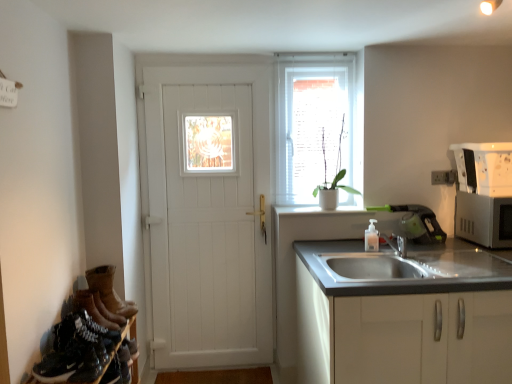
This screenshot has height=384, width=512. Describe the element at coordinates (321, 211) in the screenshot. I see `white glossy window sill at center` at that location.

Find the location of a particular element. white wooden door at center is located at coordinates (209, 221).

Find the location of a particular element. The image size is (512, 384). black leather shoe at lower left, positioned as the first shoe in back-to-front order is located at coordinates (92, 309).

How different are the orientations of brown suede boots at lower left and translucent plastic soap dispenser at sink right in degrees?

They differ by 90.2 degrees in their facing directions.

Considering the relative sizes of brown suede boots at lower left and translucent plastic soap dispenser at sink right in the image provided, is brown suede boots at lower left smaller than translucent plastic soap dispenser at sink right?

Actually, brown suede boots at lower left might be larger than translucent plastic soap dispenser at sink right.

Choose the correct answer: Is brown suede boots at lower left inside translucent plastic soap dispenser at sink right or outside it?

The correct answer is: outside.

Which is behind, point (111, 276) or point (376, 221)?

The point (376, 221) is farther.

Between white plastic electric outlet at upper right and white ceramic pot at window, which one has smaller width?

With smaller width is white plastic electric outlet at upper right.

From the picture: In terms of size, does white plastic electric outlet at upper right appear bigger or smaller than white ceramic pot at window?

Clearly, white plastic electric outlet at upper right is smaller in size than white ceramic pot at window.

Which is more distant, (436, 174) or (345, 186)?

The point (345, 186) is farther from the camera.

Which is closer, (324,102) or (437,328)?

Point (324,102) appears to be farther away from the viewer than point (437,328).

Is white matte window at center positioned in front of white matte cabinet at lower right?

No, the depth of white matte window at center is greater than that of white matte cabinet at lower right.

Based on their sizes in the image, would you say white matte window at center is bigger or smaller than white matte cabinet at lower right?

Clearly, white matte window at center is smaller in size than white matte cabinet at lower right.

From a real-world perspective, which object stands above the other?

From a 3D spatial view, white matte window at center is above.

You are a GUI agent. You are given a task and a screenshot of the screen. Output one action in this format:
    pyautogui.click(x=<x>, y=<y>)
    Task: Click on the electric outlet behind the white wooden door at center
    The width and height of the screenshot is (512, 384).
    Given the screenshot: What is the action you would take?
    pyautogui.click(x=444, y=177)

Can you tell me how much white plastic electric outlet at upper right and white wooden door at center differ in facing direction?

0.408 degrees separate the facing orientations of white plastic electric outlet at upper right and white wooden door at center.

Is the depth of white plastic electric outlet at upper right greater than that of white wooden door at center?

Yes, the depth of white plastic electric outlet at upper right is greater than that of white wooden door at center.

From the picture: Between white plastic electric outlet at upper right and white wooden door at center, which one appears on the right side from the viewer's perspective?

white plastic electric outlet at upper right.

Which is farther, (163, 320) or (323, 204)?

The point (163, 320) is farther.

Is white wooden door at center far from white ceramic pot at window?

No, white wooden door at center is in close proximity to white ceramic pot at window.

Is white wooden door at center taller than white ceramic pot at window?

Yes, white wooden door at center is taller than white ceramic pot at window.

Considering the positions of objects white wooden door at center and white ceramic pot at window in the image provided, who is more to the left, white wooden door at center or white ceramic pot at window?

white wooden door at center.

From a real-world perspective, is white wooden door at center above or below white plastic electric outlet at upper right?

white wooden door at center is situated lower than white plastic electric outlet at upper right in the real world.

Considering the relative sizes of white wooden door at center and white plastic electric outlet at upper right in the image provided, is white wooden door at center wider than white plastic electric outlet at upper right?

Yes, white wooden door at center is wider than white plastic electric outlet at upper right.

From the image's perspective, which is below, white wooden door at center or white plastic electric outlet at upper right?

white wooden door at center is shown below in the image.

Find the location of `window positioned vertically above the white glossy window sill at center (from a real-world perspective)`. window positioned vertically above the white glossy window sill at center (from a real-world perspective) is located at coordinates coord(314,123).

Is white glossy window sill at center facing away from white matte window at center?

No, white glossy window sill at center's orientation is not away from white matte window at center.

Considering the relative sizes of white glossy window sill at center and white matte window at center in the image provided, is white glossy window sill at center wider than white matte window at center?

Indeed, white glossy window sill at center has a greater width compared to white matte window at center.

Is white glossy window sill at center with white matte window at center?

white glossy window sill at center is not next to white matte window at center, and they're not touching.

The width and height of the screenshot is (512, 384). In the image, there is a translucent plastic soap dispenser at sink right. Identify the location of footwear below it (from the image's perspective). pyautogui.click(x=109, y=291).

This screenshot has width=512, height=384. Find the location of `plant in front of the white plastic electric outlet at upper right`. plant in front of the white plastic electric outlet at upper right is located at coordinates (334, 177).

From the image, which object appears to be nearer to black leather shoes at lower left, white matte cabinet at lower right or white ceramic pot at window?

white matte cabinet at lower right is positioned closer to the anchor black leather shoes at lower left.

When comparing their distances from white plastic electric outlet at upper right, does white glossy window sill at center or translucent plastic soap dispenser at sink right seem closer?

Among the two, translucent plastic soap dispenser at sink right is located nearer to white plastic electric outlet at upper right.

From the image, which object appears to be farther from translucent plastic soap dispenser at sink right, white glossy window sill at center or black leather shoes at lower left?

Among the two, black leather shoes at lower left is located further to translucent plastic soap dispenser at sink right.

When comparing their distances from brown suede boots at lower left, does black leather shoes at lower left or white wooden door at center seem closer?

black leather shoes at lower left is positioned closer to the anchor brown suede boots at lower left.

Looking at the image, which one is located closer to white matte window at center, brown suede boots at lower left or white matte cabinet at lower right?

Among the two, white matte cabinet at lower right is located nearer to white matte window at center.

Estimate the real-world distances between objects in this image. Which object is further from translucent plastic soap dispenser at sink right, shiny black sneaker at lower left, the 1th shoe viewed from the front, or white matte window at center?

shiny black sneaker at lower left, the 1th shoe viewed from the front.

Estimate the real-world distances between objects in this image. Which object is closer to white matte cabinet at lower right, black leather shoes at lower left or black leather shoe at lower left, positioned as the first shoe in back-to-front order?

black leather shoes at lower left is closer to white matte cabinet at lower right.

Considering their positions, is black leather shoes at lower left positioned further to black leather shoe at lower left, placed as the second shoe when sorted from front to back, than white matte window at center?

Among the two, white matte window at center is located further to black leather shoe at lower left, placed as the second shoe when sorted from front to back.

This screenshot has height=384, width=512. Find the location of `footwear between black leather shoe at lower left, positioned as the first shoe in back-to-front order, and white wooden door at center in the front-back direction`. footwear between black leather shoe at lower left, positioned as the first shoe in back-to-front order, and white wooden door at center in the front-back direction is located at coordinates (109, 291).

You are a GUI agent. You are given a task and a screenshot of the screen. Output one action in this format:
    pyautogui.click(x=<x>, y=<y>)
    Task: Click on the door between black leather shoe at lower left, positioned as the first shoe in back-to-front order, and silver metallic microwave at right
    The width and height of the screenshot is (512, 384).
    Given the screenshot: What is the action you would take?
    [x=209, y=221]

Find the location of `plant between shiny black sneaker at lower left, acting as the second shoe starting from the back, and white matte cabinet at lower right from left to right`. plant between shiny black sneaker at lower left, acting as the second shoe starting from the back, and white matte cabinet at lower right from left to right is located at coordinates (334, 177).

This screenshot has height=384, width=512. Find the location of `window sill between black leather shoes at lower left and white matte cabinet at lower right from left to right`. window sill between black leather shoes at lower left and white matte cabinet at lower right from left to right is located at coordinates (321, 211).